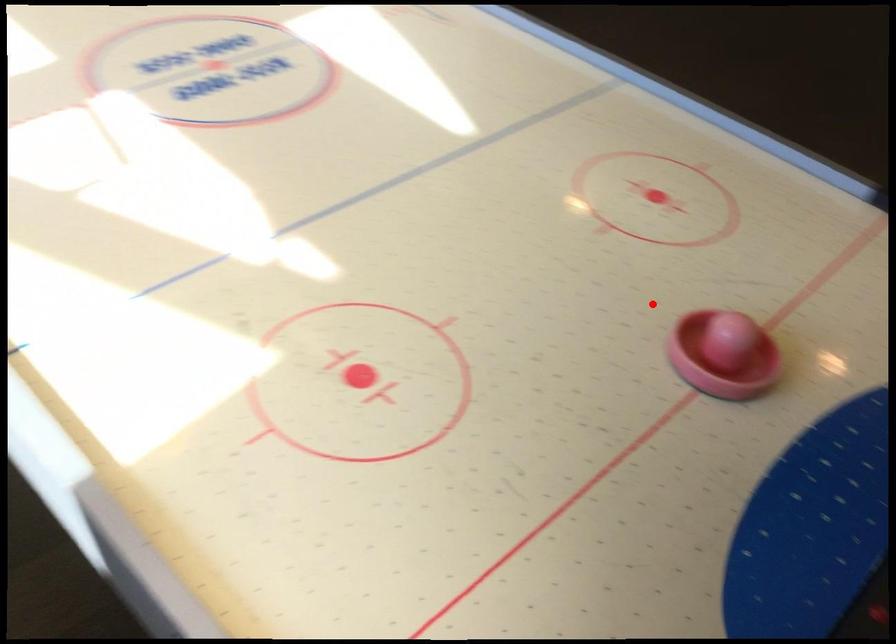
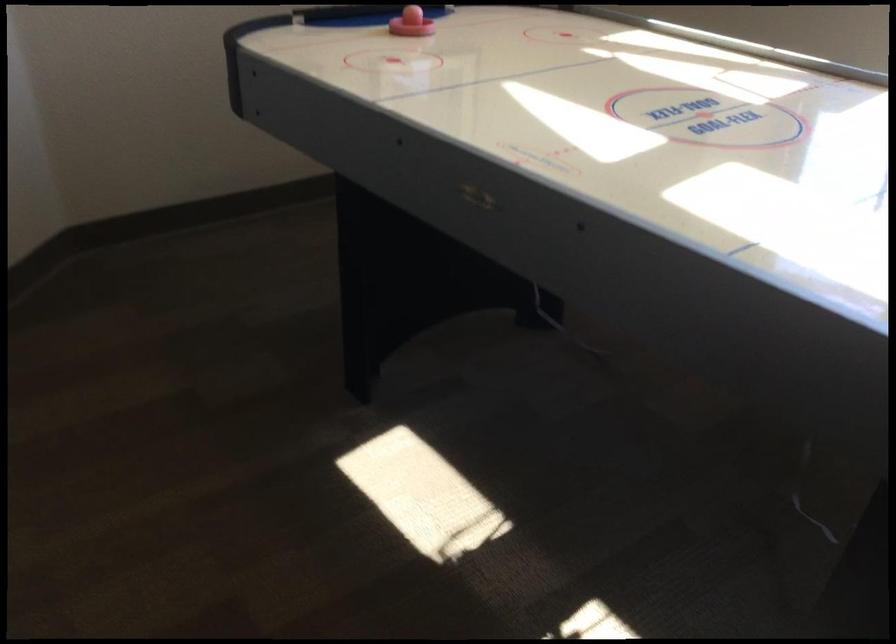
Question: I am providing you with two images of the same scene from different viewpoints. Image1 has a red point marked. In image2, the corresponding 3D location appears at what relative position? Reply with the corresponding letter.

Choices:
 (A) Closer
 (B) Farther

Answer: (B)